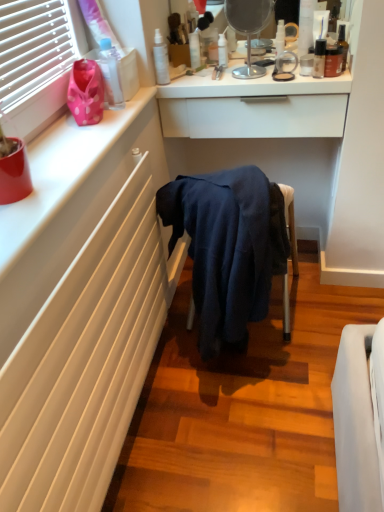
Question: Which direction should I rotate to look at transparent plastic bottle at upper center, which ranks as the sixth toiletry in right-to-left order, — up or down?

Choices:
 (A) down
 (B) up

Answer: (B)

Question: Can you confirm if white matte counter top at upper left is bigger than satin white spray bottle at upper center, the 2th toiletry from the left?

Choices:
 (A) no
 (B) yes

Answer: (B)

Question: Would you say white matte counter top at upper left contains satin white spray bottle at upper center, marked as the seventh toiletry in a right-to-left arrangement?

Choices:
 (A) yes
 (B) no

Answer: (B)

Question: From a real-world perspective, is white matte counter top at upper left located beneath satin white spray bottle at upper center, marked as the seventh toiletry in a right-to-left arrangement?

Choices:
 (A) yes
 (B) no

Answer: (A)

Question: From a real-world perspective, is white matte counter top at upper left on satin white spray bottle at upper center, marked as the seventh toiletry in a right-to-left arrangement?

Choices:
 (A) yes
 (B) no

Answer: (B)

Question: Is white matte counter top at upper left oriented towards satin white spray bottle at upper center, the 2th toiletry from the left?

Choices:
 (A) yes
 (B) no

Answer: (B)

Question: Is white matte counter top at upper left positioned far away from satin white spray bottle at upper center, the 2th toiletry from the left?

Choices:
 (A) no
 (B) yes

Answer: (A)

Question: From a real-world perspective, is satin white spray bottle at upper center, the 2th toiletry from the left, over metallic silver mirror at upper center?

Choices:
 (A) yes
 (B) no

Answer: (B)

Question: From the image's perspective, is satin white spray bottle at upper center, marked as the seventh toiletry in a right-to-left arrangement, located beneath metallic silver mirror at upper center?

Choices:
 (A) no
 (B) yes

Answer: (B)

Question: Is satin white spray bottle at upper center, marked as the seventh toiletry in a right-to-left arrangement, to the right of metallic silver mirror at upper center from the viewer's perspective?

Choices:
 (A) no
 (B) yes

Answer: (A)

Question: From a real-world perspective, is satin white spray bottle at upper center, the 2th toiletry from the left, located beneath metallic silver mirror at upper center?

Choices:
 (A) yes
 (B) no

Answer: (A)

Question: Is satin white spray bottle at upper center, the 2th toiletry from the left, oriented towards metallic silver mirror at upper center?

Choices:
 (A) yes
 (B) no

Answer: (B)

Question: Considering the relative sizes of satin white spray bottle at upper center, marked as the seventh toiletry in a right-to-left arrangement, and metallic silver mirror at upper center in the image provided, is satin white spray bottle at upper center, marked as the seventh toiletry in a right-to-left arrangement, taller than metallic silver mirror at upper center?

Choices:
 (A) no
 (B) yes

Answer: (A)

Question: Is transparent plastic bottle at upper center, arranged as the third toiletry when viewed from the left, in front of white glossy drawer at upper center?

Choices:
 (A) no
 (B) yes

Answer: (A)